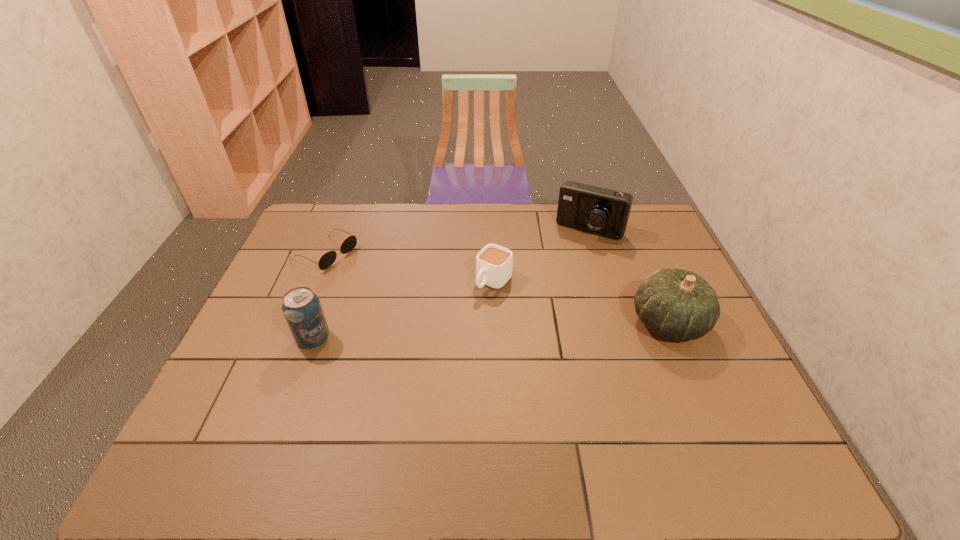
At what (x,y) coordinates should I click in order to perform the action: click on vacant space located on the front-facing side of the sunglasses. Please return your answer as a coordinate pair (x, y). Looking at the image, I should click on (381, 279).

Identify the location of free spot located 0.370m on the front-facing side of the camera. The width and height of the screenshot is (960, 540). (534, 312).

Where is `free region located 0.270m on the front-facing side of the camera`? Image resolution: width=960 pixels, height=540 pixels. free region located 0.270m on the front-facing side of the camera is located at coordinates (547, 291).

This screenshot has height=540, width=960. I want to click on free region located on the front-facing side of the camera, so click(552, 283).

You are a GUI agent. You are given a task and a screenshot of the screen. Output one action in this format:
    pyautogui.click(x=<x>, y=<y>)
    Task: Click on the vacant area situated on the side with the handle of the fourth tallest object
    
    Given the screenshot: What is the action you would take?
    pyautogui.click(x=440, y=343)

Find the location of a particular element. The width and height of the screenshot is (960, 540). free space located 0.230m on the side with the handle of the fourth tallest object is located at coordinates click(x=438, y=346).

The width and height of the screenshot is (960, 540). In order to click on vacant space located 0.240m on the side with the handle of the fourth tallest object in this screenshot , I will do `click(435, 348)`.

Find the location of a particular element. This screenshot has height=540, width=960. sunglasses that is at the far edge is located at coordinates (327, 259).

The height and width of the screenshot is (540, 960). What are the coordinates of `camera situated at the far edge` in the screenshot? It's located at (597, 210).

Locate an element on the screen. pop soda present at the left edge is located at coordinates (302, 309).